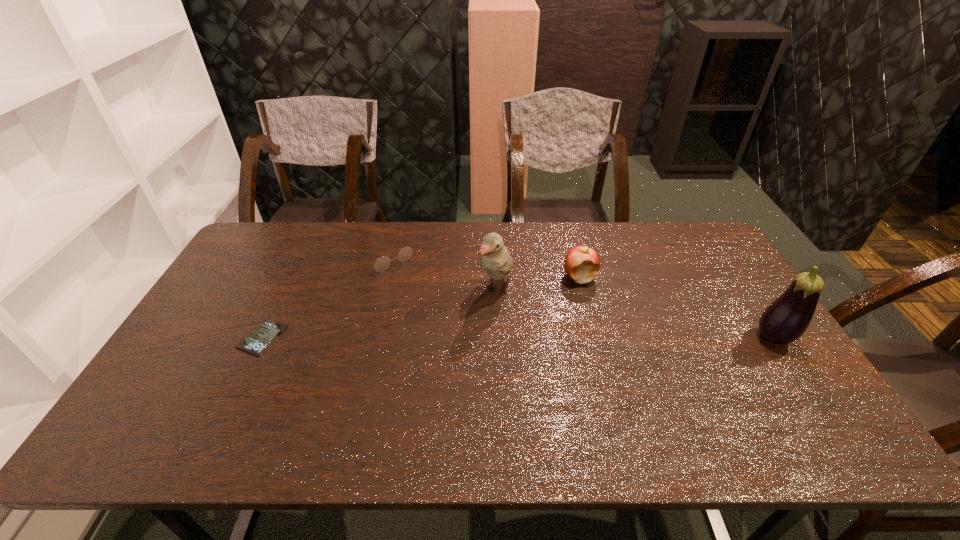
I want to click on free point between the eggplant and the third object from left to right, so click(x=636, y=313).

At what (x,y) coordinates should I click in order to perform the action: click on free spot between the bird and the second object from left to right. Please return your answer as a coordinate pair (x, y). Looking at the image, I should click on (441, 273).

Find the location of a particular element. The height and width of the screenshot is (540, 960). free space between the identity card and the spectacles is located at coordinates (323, 297).

The height and width of the screenshot is (540, 960). In order to click on free space between the bird and the rightmost object in this screenshot , I will do `click(636, 313)`.

This screenshot has height=540, width=960. In order to click on vacant area that lies between the second shortest object and the rightmost object in this screenshot , I will do `click(579, 296)`.

The width and height of the screenshot is (960, 540). Find the location of `free space between the rightmost object and the bird`. free space between the rightmost object and the bird is located at coordinates (636, 313).

The image size is (960, 540). Find the location of `free space between the fourth tallest object and the third object from right to left`. free space between the fourth tallest object and the third object from right to left is located at coordinates (441, 273).

Where is `unoccupied position between the third shortest object and the rightmost object`? This screenshot has width=960, height=540. unoccupied position between the third shortest object and the rightmost object is located at coordinates (677, 307).

Find the location of a particular element. Image resolution: width=960 pixels, height=540 pixels. free space that is in between the bird and the rightmost object is located at coordinates (636, 313).

Identify the location of object that is the fourth closest one to the fourth object from right to left. This screenshot has height=540, width=960. (785, 320).